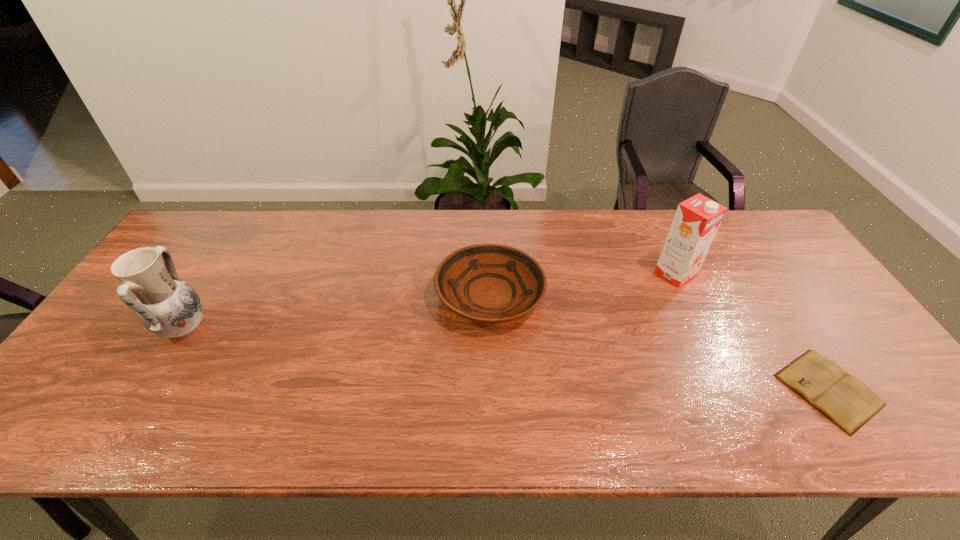
I want to click on object positioned at the near edge, so click(849, 403).

Find the location of a particular element. object positioned at the left edge is located at coordinates (168, 307).

Locate an element on the screen. Image resolution: width=960 pixels, height=540 pixels. object that is positioned at the right edge is located at coordinates (849, 403).

Find the location of a particular element. The width and height of the screenshot is (960, 540). object present at the near right corner is located at coordinates (849, 403).

You are a GUI agent. You are given a task and a screenshot of the screen. Output one action in this format:
    pyautogui.click(x=<x>, y=<y>)
    Task: Click on the blank space at the far edge of the desktop
    
    Given the screenshot: What is the action you would take?
    pyautogui.click(x=453, y=210)

The width and height of the screenshot is (960, 540). Identify the location of free region at the near edge of the desktop. (303, 412).

Identify the location of free region at the left edge of the desktop. (79, 364).

Where is `free space at the far left corner of the desktop`? free space at the far left corner of the desktop is located at coordinates (229, 222).

Where is `free spot at the far right corner of the desktop`? free spot at the far right corner of the desktop is located at coordinates (752, 237).

This screenshot has height=540, width=960. I want to click on vacant space that's between the second object from left to right and the carton, so click(x=583, y=285).